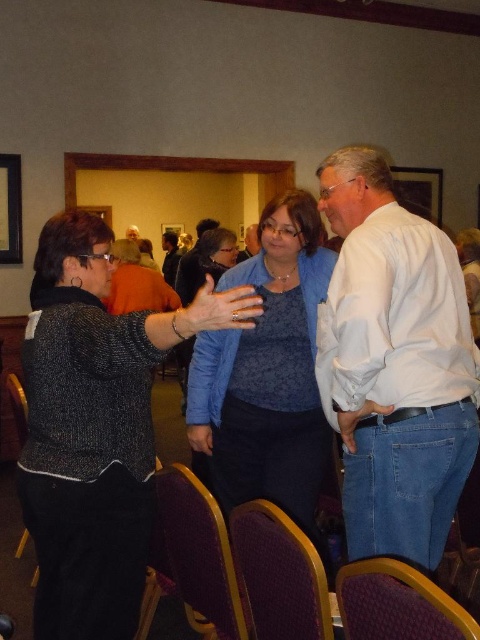
Who is positioned more to the left, velvet purple chair at center or blue fabric shirt at center?

From the viewer's perspective, blue fabric shirt at center appears more on the left side.

From the picture: Is velvet purple chair at center shorter than blue fabric shirt at center?

Yes, velvet purple chair at center is shorter than blue fabric shirt at center.

What do you see at coordinates (397, 604) in the screenshot? I see `velvet purple chair at center` at bounding box center [397, 604].

Locate an element on the screen. Image resolution: width=480 pixels, height=640 pixels. velvet purple chair at center is located at coordinates (397, 604).

From the picture: Between white cotton shirt at right and purple fabric chair at lower center, which one appears on the right side from the viewer's perspective?

white cotton shirt at right is more to the right.

Which is behind, point (430, 278) or point (220, 596)?

Point (430, 278)

This screenshot has height=640, width=480. In order to click on white cotton shirt at right in this screenshot , I will do `click(395, 364)`.

In the scene shown: Which of these two, purple fabric chair at lower center or matte black jacket at center, stands shorter?

purple fabric chair at lower center

Who is more forward, (181, 522) or (178, 252)?

Point (181, 522) is in front.

I want to click on purple fabric chair at lower center, so click(192, 557).